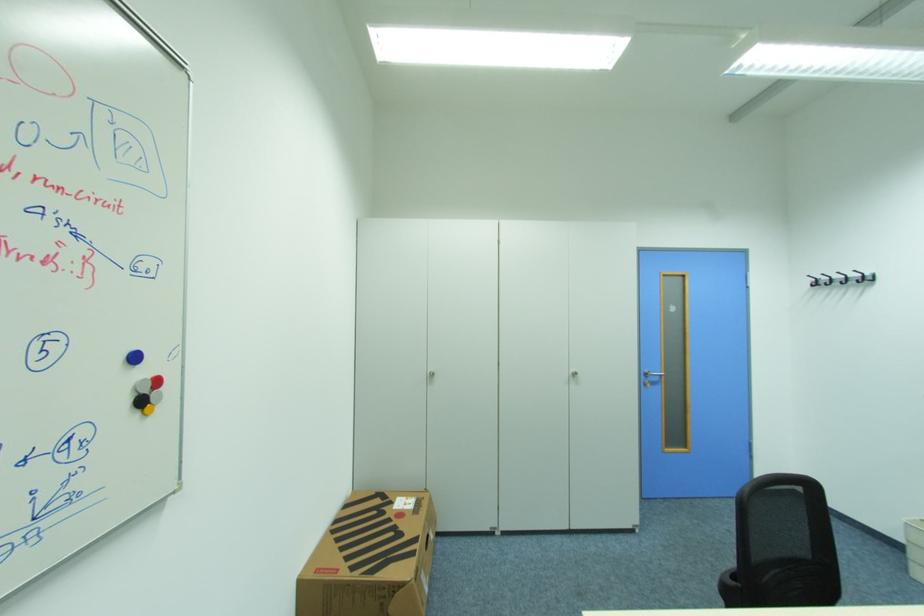
Image resolution: width=924 pixels, height=616 pixels. I want to click on black coat hook, so click(x=841, y=278).